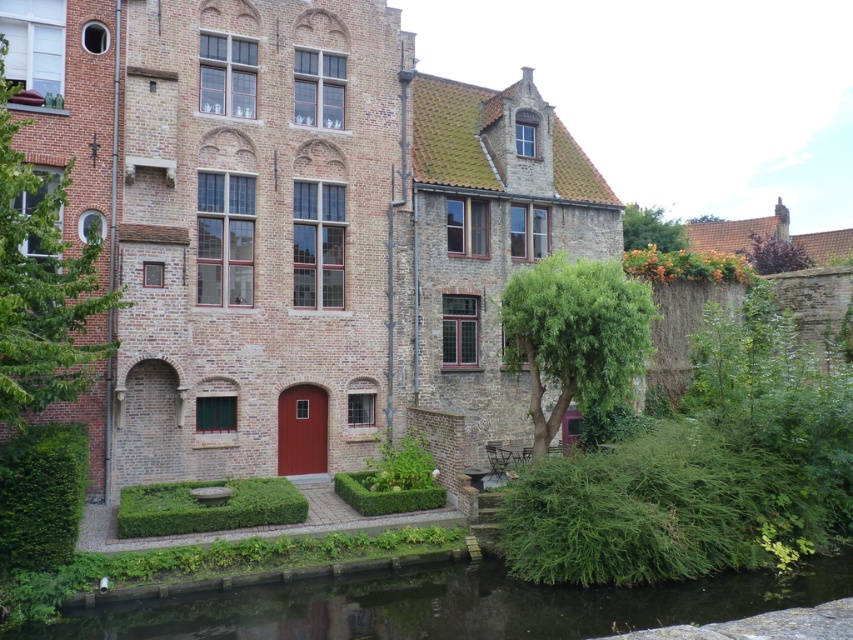
Question: Which of these objects is positioned closest to the purple leafy tree at upper right?

Choices:
 (A) green leafy tree at upper left
 (B) green grassy river at bottom

Answer: (B)

Question: Does green leafy tree at upper left appear over green leafy tree at upper right?

Choices:
 (A) no
 (B) yes

Answer: (A)

Question: Which is farther from the purple leafy tree at upper right?

Choices:
 (A) green leafy tree at upper right
 (B) green grassy river at bottom
 (C) green leafy tree at center

Answer: (B)

Question: Which of the following is the closest to the observer?

Choices:
 (A) (219, 609)
 (B) (35, 205)
 (C) (560, 259)

Answer: (A)

Question: Is green leafy tree at upper left thinner than green leafy tree at center?

Choices:
 (A) yes
 (B) no

Answer: (A)

Question: Is green leafy tree at center positioned at the back of purple leafy tree at upper right?

Choices:
 (A) yes
 (B) no

Answer: (B)